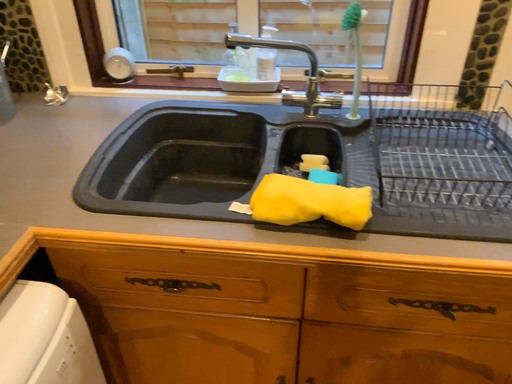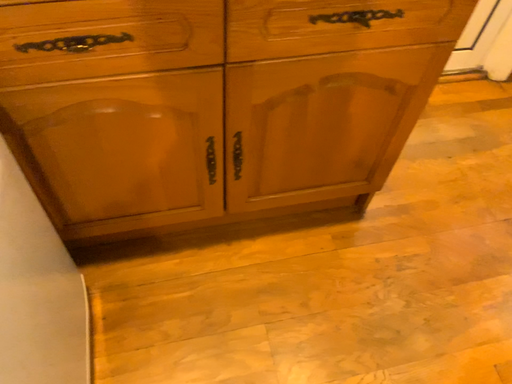
Question: Which way did the camera rotate in the video?

Choices:
 (A) rotated upward
 (B) rotated downward

Answer: (B)